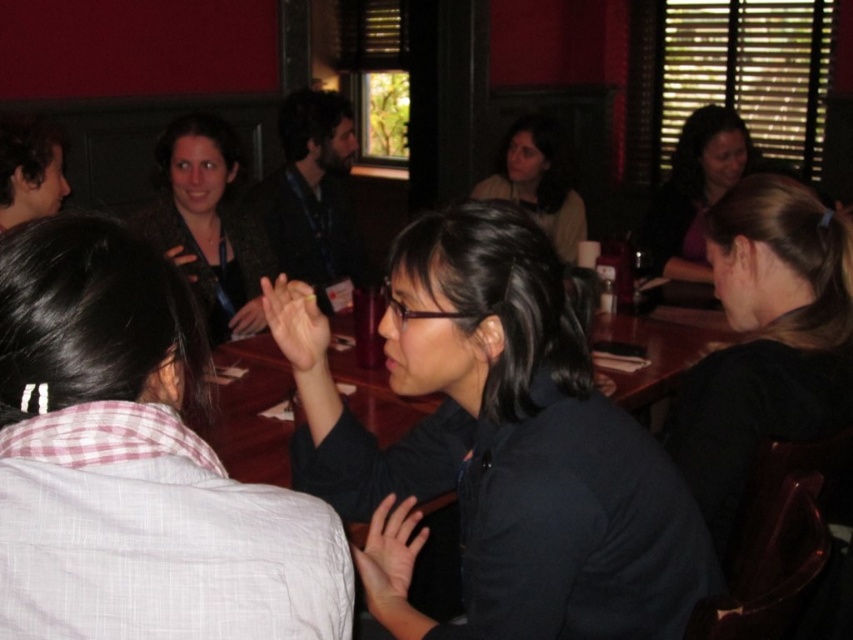
Is plaid shirt at center positioned in front of shiny black jacket at upper left?

That is True.

Does plaid shirt at center appear on the left side of shiny black jacket at upper left?

No, plaid shirt at center is not to the left of shiny black jacket at upper left.

Is point (32, 237) positioned before point (221, 328)?

That is True.

Find the location of `plaid shirt at center`. plaid shirt at center is located at coordinates (134, 465).

Who is shorter, shiny black jacket at upper left or matte black shirt at center?

matte black shirt at center is shorter.

Can you confirm if shiny black jacket at upper left is bigger than matte black shirt at center?

Correct, shiny black jacket at upper left is larger in size than matte black shirt at center.

Which is in front, point (183, 188) or point (506, 193)?

Point (183, 188)

The image size is (853, 640). What are the coordinates of `shiny black jacket at upper left` in the screenshot? It's located at (207, 225).

Is black matte shirt at center further to camera compared to matte purple shirt at upper right?

No, it is in front of matte purple shirt at upper right.

Who is positioned more to the left, black matte shirt at center or matte purple shirt at upper right?

From the viewer's perspective, black matte shirt at center appears more on the left side.

Is point (653, 456) closer to camera compared to point (679, 241)?

Yes.

Identify the location of black matte shirt at center. (505, 442).